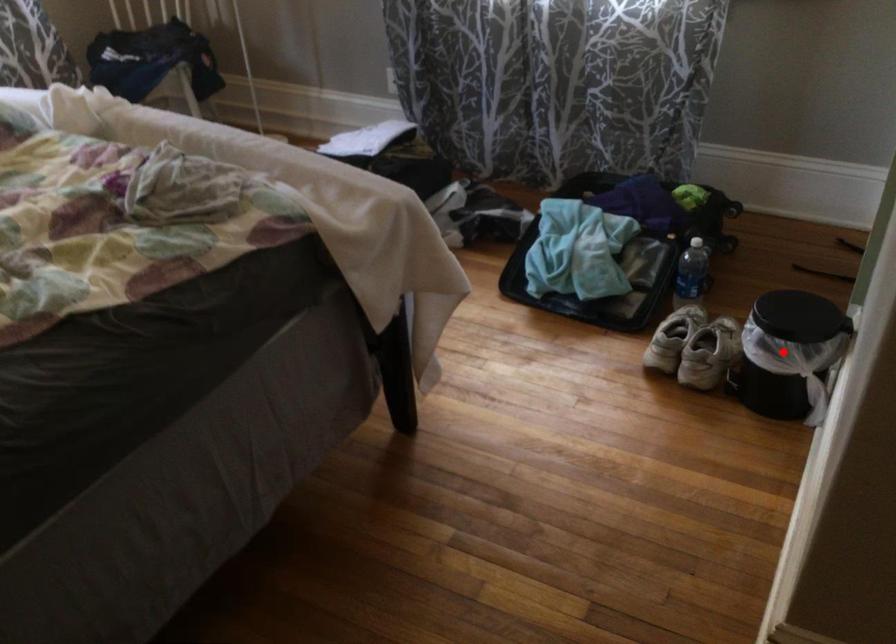
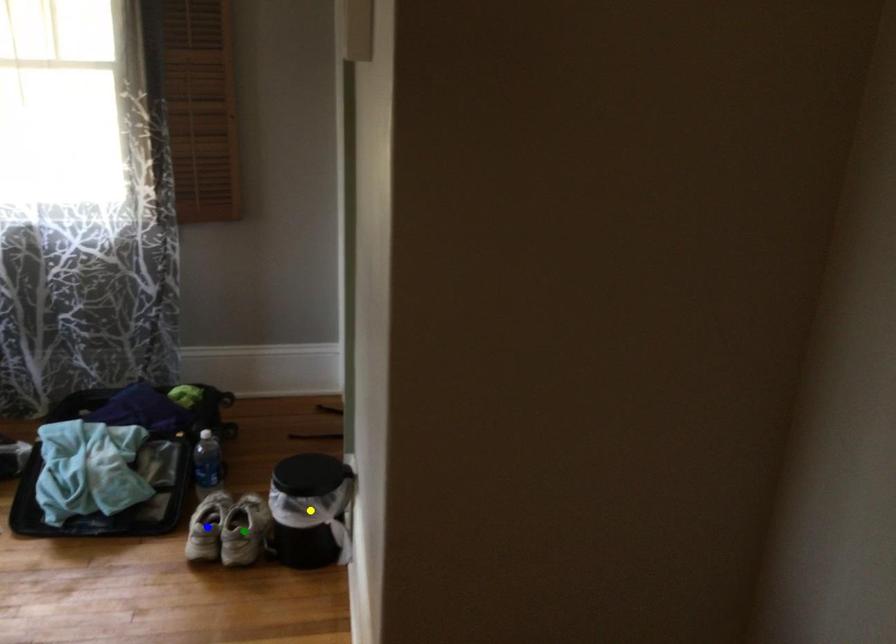
Question: I am providing you with two images of the same scene from different viewpoints. A red point is marked on the first image. You are given multiple points on the second image. In image 2, which mark is for the same physical point as the one in image 1?

Choices:
 (A) green point
 (B) yellow point
 (C) blue point

Answer: (B)